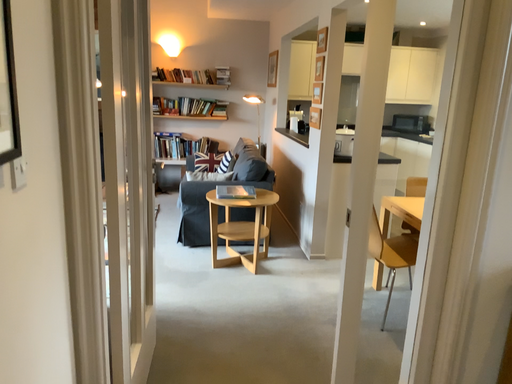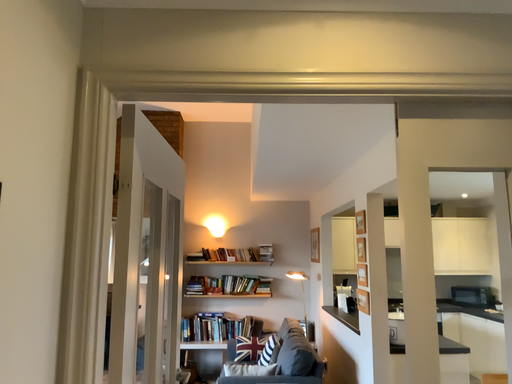
Question: How did the camera likely rotate when shooting the video?

Choices:
 (A) rotated left
 (B) rotated right

Answer: (A)